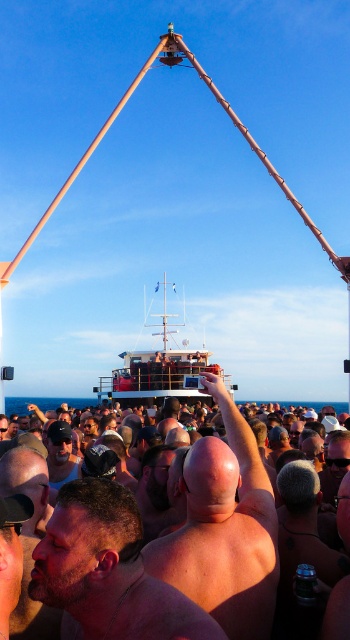
You are a photographer trying to capture a photo of the beige skin at center and the wooden ship at center from above. Which object would appear smaller in the photo?

The beige skin at center would appear smaller in the photo because it is shorter than the wooden ship at center.

From the picture: You are standing on the deck of the wooden ship at center and want to move towards the area where the beige skin at center is located. In which direction should you go?

The beige skin at center is positioned on the right side of wooden ship at center, so you should move towards the right side of the wooden ship at center to reach the beige skin at center.